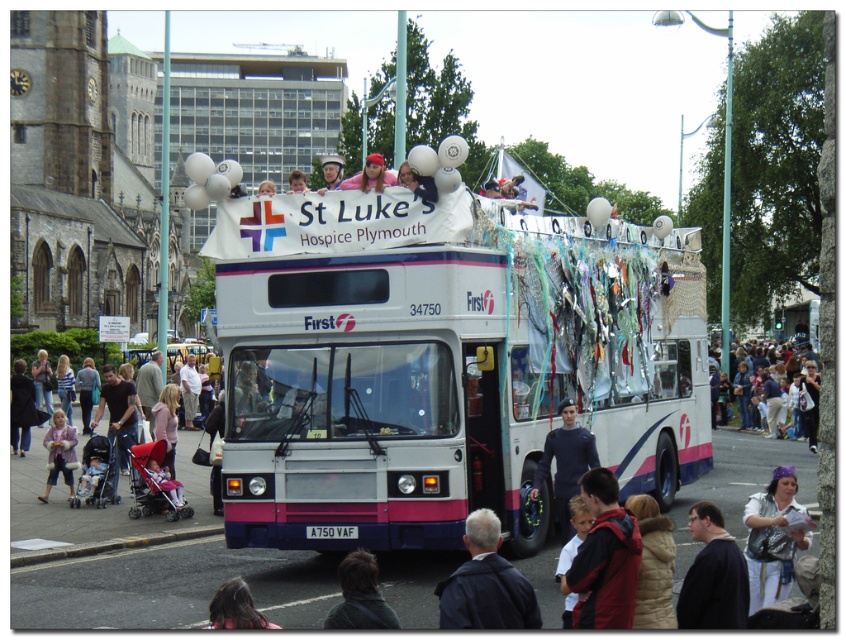
You are a photographer trying to capture a clear shot of the dark blue fabric at center and the light beige fabric crowd at right. Which fabric is positioned lower in the image?

The dark blue fabric at center is located below the light beige fabric crowd at right, so it is positioned lower in the image.

You are a photographer standing in front of the St Luke Hospice Plymouth bus. You notice two fabrics in the scene, the light beige fabric crowd at right and the light pink fabric at lower left. Which fabric is higher in the image?

The light beige fabric crowd at right is positioned over the light pink fabric at lower left, so the light beige fabric crowd at right is higher in the image.

You are a photographer standing in the crowd at the St Luke Hospice Plymouth parade. You see a dark blue sweater at center and a light pink fabric at lower left. Which object is wider when viewed from your perspective?

The light pink fabric at lower left is wider than the dark blue sweater at center.